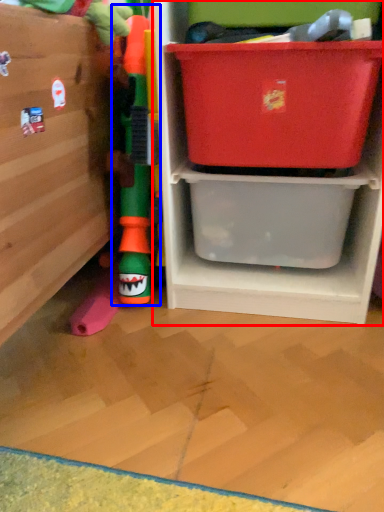
Question: Which object appears closest to the camera in this image, shelf (highlighted by a red box) or toy (highlighted by a blue box)?

Choices:
 (A) shelf
 (B) toy

Answer: (A)